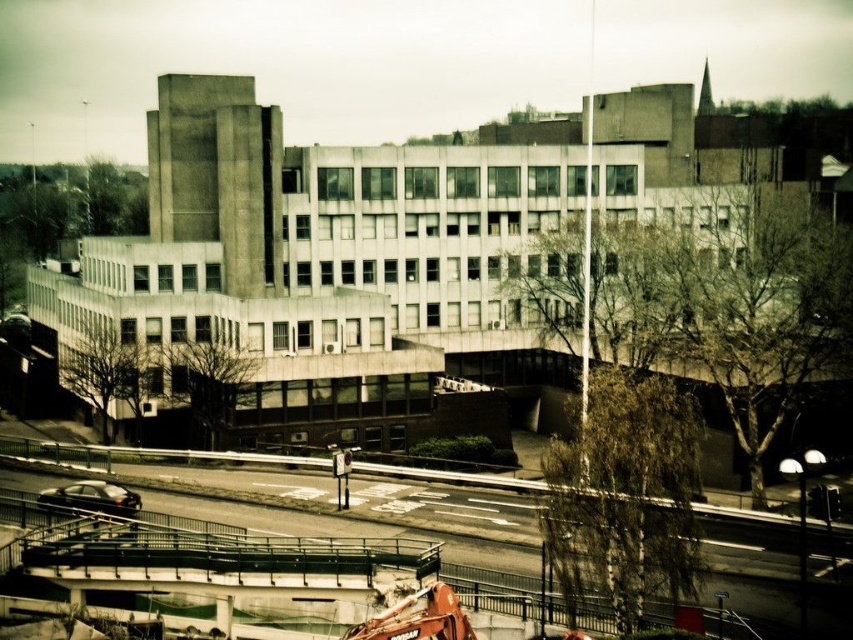
You are a pedestrian standing at the edge of the road. You see the concrete at center and the orange metallic crane at center. Which object is closer to your left side?

The concrete at center is closer to your left side because it is positioned to the left of the orange metallic crane at center.

You are a delivery driver who needs to pass through the area between the concrete at center and the orange metallic crane at center. The width of your truck is 2 meters. Can you safely navigate through this space?

The concrete at center might be wider than orange metallic crane at center, so there might be enough space for the truck to pass through. However, since the exact width difference isn not specified, it is recommended to proceed with caution or measure the space before driving through.

From the picture: You are a construction worker who needs to determine if the orange metallic crane at center can safely lift materials over the concrete at center without hitting the structure. Based on their heights, is this possible?

The concrete at center has a greater height compared to the orange metallic crane at center. Therefore, the crane may not be tall enough to lift materials over the concrete without hitting it, posing a risk of collision.